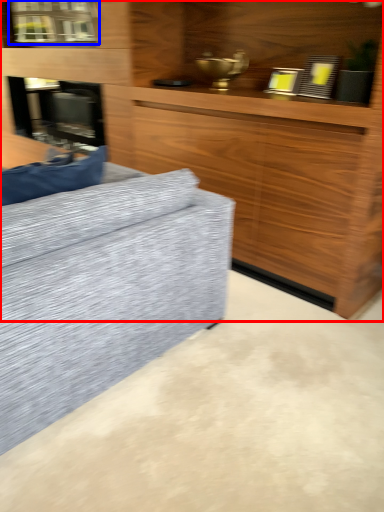
Question: Which of the following is the farthest to the observer, cabinetry (highlighted by a red box) or window (highlighted by a blue box)?

Choices:
 (A) cabinetry
 (B) window

Answer: (B)